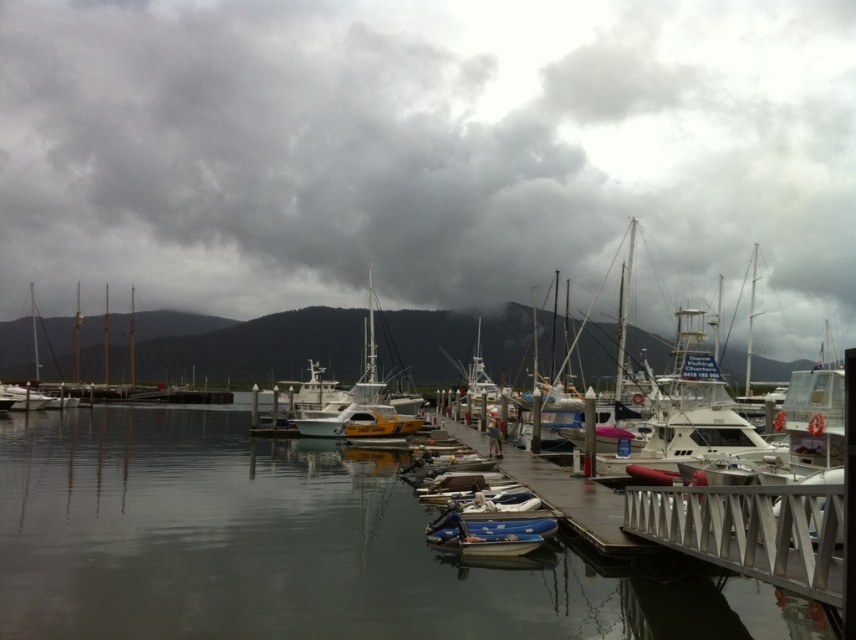
Based on the photo, is glossy water at center further to camera compared to white glossy sailboat at left?

No.

Does glossy water at center have a greater height compared to white glossy sailboat at left?

No.

Between point (325, 630) and point (15, 408), which one is positioned behind?

Positioned behind is point (15, 408).

Find the location of a particular element. glossy water at center is located at coordinates (296, 547).

Is yellow matte boat at center to the right of white glossy sailboat at left from the viewer's perspective?

Indeed, yellow matte boat at center is positioned on the right side of white glossy sailboat at left.

Which is more to the right, yellow matte boat at center or white glossy sailboat at left?

From the viewer's perspective, yellow matte boat at center appears more on the right side.

I want to click on yellow matte boat at center, so click(x=360, y=400).

Can you confirm if dark gray cloud at upper center is taller than metallic dock at center?

Correct, dark gray cloud at upper center is much taller as metallic dock at center.

Can you confirm if dark gray cloud at upper center is positioned below metallic dock at center?

No, dark gray cloud at upper center is not below metallic dock at center.

At what (x,y) coordinates should I click in order to perform the action: click on dark gray cloud at upper center. Please return your answer as a coordinate pair (x, y). This screenshot has height=640, width=856. Looking at the image, I should click on (428, 150).

Where is `dark gray cloud at upper center`? dark gray cloud at upper center is located at coordinates (428, 150).